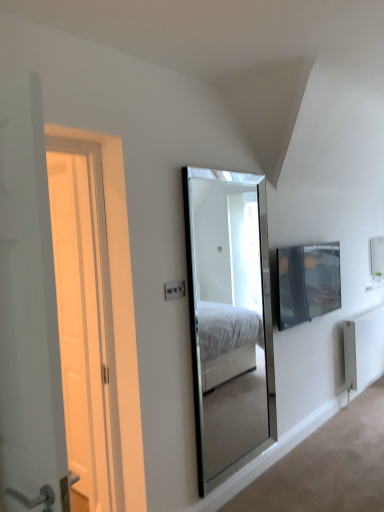
Question: From a real-world perspective, is white wooden door at left physically above white metallic radiator at lower right?

Choices:
 (A) yes
 (B) no

Answer: (A)

Question: From the image's perspective, is white wooden door at left located beneath white metallic radiator at lower right?

Choices:
 (A) yes
 (B) no

Answer: (B)

Question: Is white wooden door at left placed right next to white metallic radiator at lower right?

Choices:
 (A) no
 (B) yes

Answer: (A)

Question: Does white wooden door at left have a greater height compared to white metallic radiator at lower right?

Choices:
 (A) yes
 (B) no

Answer: (A)

Question: From the image's perspective, is white wooden door at left over white metallic radiator at lower right?

Choices:
 (A) no
 (B) yes

Answer: (B)

Question: From their relative heights in the image, would you say matte black tv at right is taller or shorter than clear glass mirror at center?

Choices:
 (A) short
 (B) tall

Answer: (A)

Question: Choose the correct answer: Is matte black tv at right inside clear glass mirror at center or outside it?

Choices:
 (A) inside
 (B) outside

Answer: (B)

Question: Does point (279, 316) appear closer or farther from the camera than point (215, 480)?

Choices:
 (A) farther
 (B) closer

Answer: (A)

Question: From a real-world perspective, relative to clear glass mirror at center, is matte black tv at right vertically above or below?

Choices:
 (A) below
 (B) above

Answer: (B)

Question: Considering the positions of white plastic electric outlet at center and clear glass mirror at center in the image, is white plastic electric outlet at center taller or shorter than clear glass mirror at center?

Choices:
 (A) tall
 (B) short

Answer: (B)

Question: From a real-world perspective, is white plastic electric outlet at center physically located above or below clear glass mirror at center?

Choices:
 (A) above
 (B) below

Answer: (A)

Question: Is point (173, 297) positioned closer to the camera than point (264, 340)?

Choices:
 (A) closer
 (B) farther

Answer: (A)

Question: From the image's perspective, is white plastic electric outlet at center above or below clear glass mirror at center?

Choices:
 (A) below
 (B) above

Answer: (B)

Question: Considering the positions of white metallic radiator at lower right and clear glass mirror at center in the image, is white metallic radiator at lower right bigger or smaller than clear glass mirror at center?

Choices:
 (A) small
 (B) big

Answer: (B)

Question: In the image, is white metallic radiator at lower right on the left side or the right side of clear glass mirror at center?

Choices:
 (A) left
 (B) right

Answer: (B)